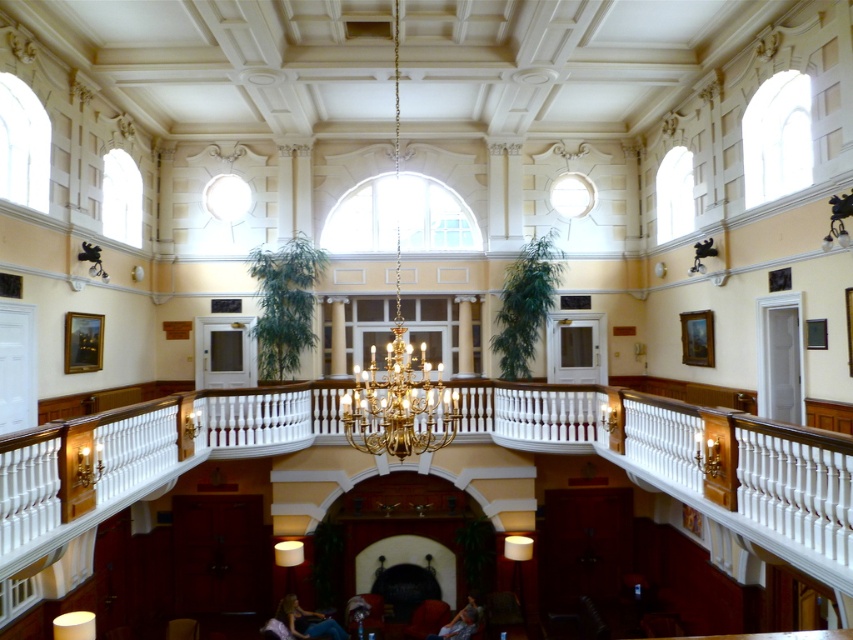
Question: Which point appears farthest from the camera in this image?

Choices:
 (A) (386, 433)
 (B) (277, 616)

Answer: (B)

Question: Can you confirm if gold metallic chandelier at center is positioned below light brown leather jacket at lower center?

Choices:
 (A) yes
 (B) no

Answer: (B)

Question: From the image, what is the correct spatial relationship of gold metallic chandelier at center in relation to light brown leather jacket at lower center?

Choices:
 (A) below
 (B) above

Answer: (B)

Question: Which is nearer to the gold metallic chandelier at center?

Choices:
 (A) light brown leather jacket at lower center
 (B) blue fabric person at lower center

Answer: (B)

Question: Estimate the real-world distances between objects in this image. Which object is closer to the light brown leather jacket at lower center?

Choices:
 (A) gold metallic chandelier at center
 (B) blue fabric person at lower center

Answer: (B)

Question: Can you confirm if blue fabric person at lower center is bigger than light brown leather jacket at lower center?

Choices:
 (A) no
 (B) yes

Answer: (B)